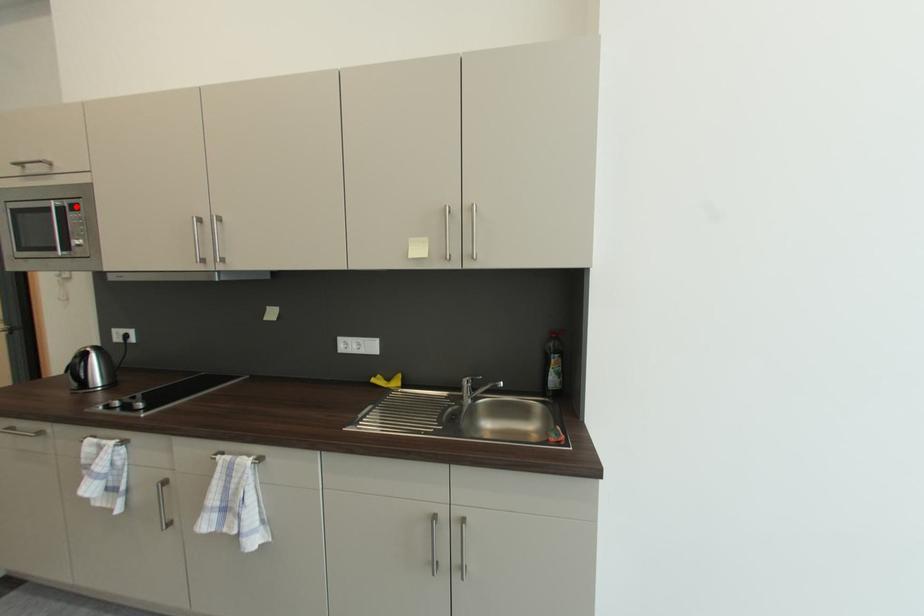
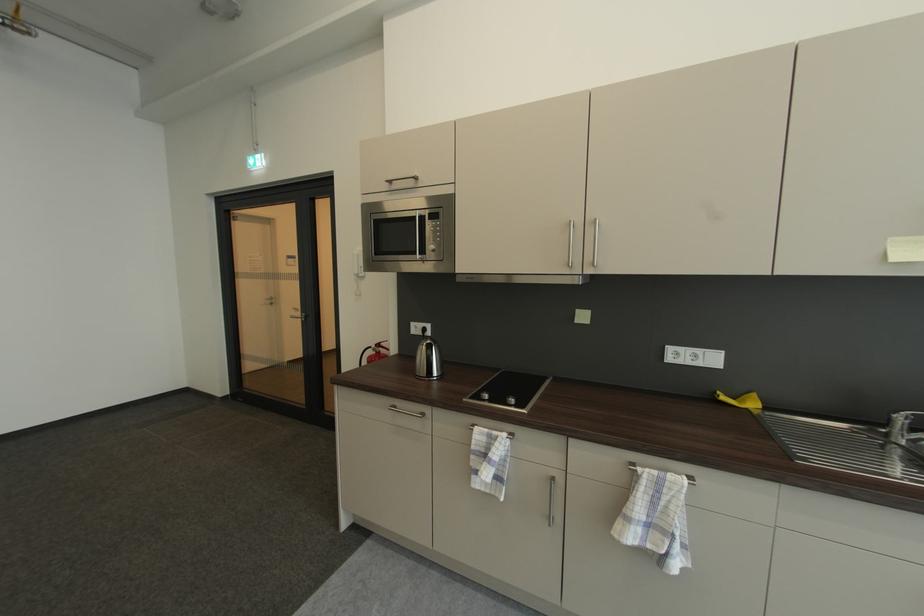
Find the pixel in the second image that matches the highlighted location in the first image.

(436, 215)